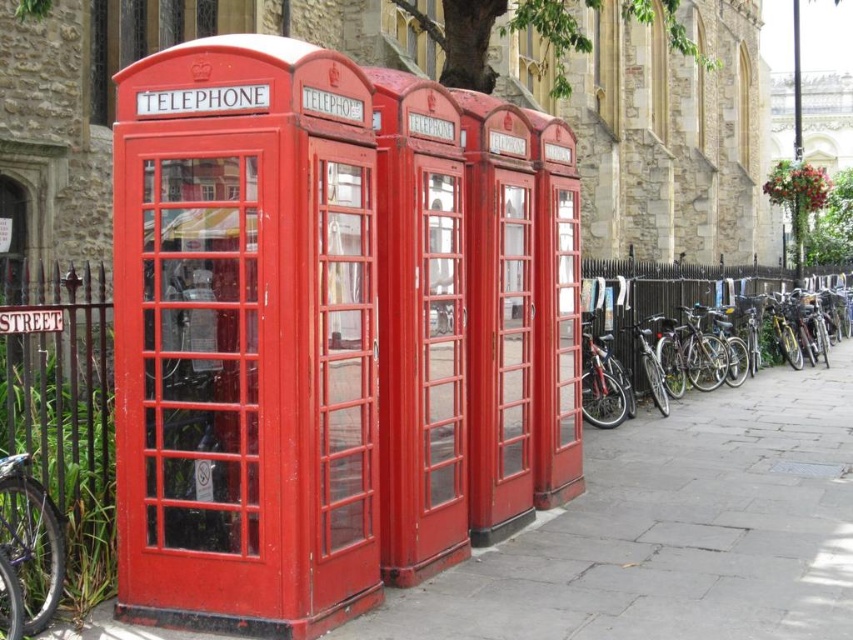
You are standing at the origin point of the scene. The black metal fence is to your right. Which direction should you walk to reach the matte glass telephone booth at left?

The matte glass telephone booth at left is located at point (245, 339), so you should walk towards the left side of the scene to reach it since it is positioned to the left of your current position.

You are a delivery person who needs to park your bike between the two telephone booths and the fence. Which bicycle, the shiny metallic bicycle at right or the metallic purple bicycle at lower left, is closer to the fence?

The shiny metallic bicycle at right is closer to the fence because it is positioned to the right of the metallic purple bicycle at lower left, which is closer to the telephone booths.